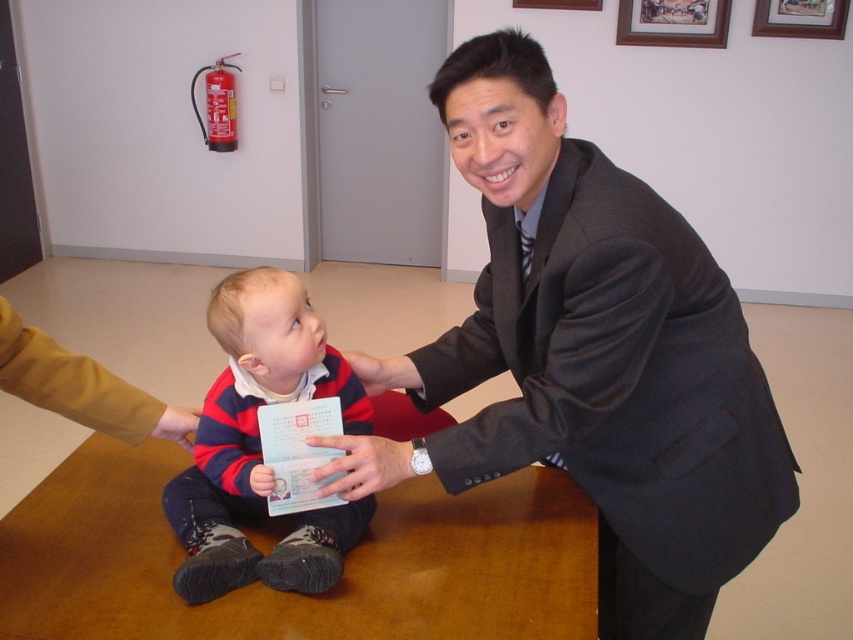
Question: Is dark gray suit at center bigger than smooth skin hand at center?

Choices:
 (A) yes
 (B) no

Answer: (A)

Question: Can you confirm if dark gray suit at center is positioned below smooth skin hand at center?

Choices:
 (A) no
 (B) yes

Answer: (A)

Question: Can you confirm if dark gray suit at center is wider than striped cotton shirt at center?

Choices:
 (A) no
 (B) yes

Answer: (B)

Question: Which point is farther to the camera?

Choices:
 (A) (183, 428)
 (B) (323, 436)

Answer: (A)

Question: Among these objects, which one is nearest to the camera?

Choices:
 (A) dark gray suit at center
 (B) smooth skin hand at center
 (C) striped cotton shirt at center
 (D) matte plastic card at center

Answer: (A)

Question: Which of the following is the farthest from the observer?

Choices:
 (A) matte plastic card at center
 (B) smooth skin hand at center

Answer: (A)